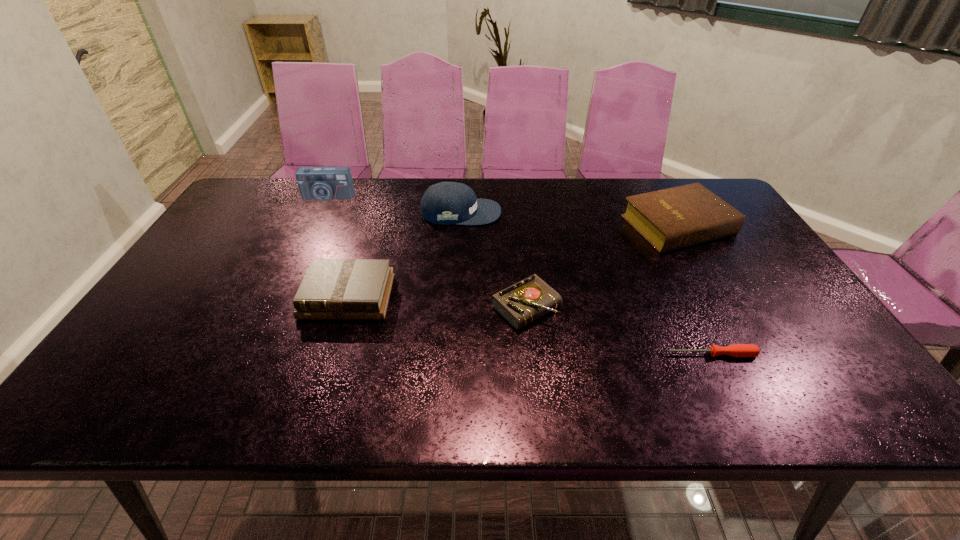
I want to click on free space located 0.210m on the spine side of the nearer Bible, so click(x=316, y=397).

Where is `blank space located 0.280m on the right of the diary`? blank space located 0.280m on the right of the diary is located at coordinates (673, 307).

Locate an element on the screen. This screenshot has height=540, width=960. free space located at the tip of the screwdriver is located at coordinates (547, 354).

You are a GUI agent. You are given a task and a screenshot of the screen. Output one action in this format:
    pyautogui.click(x=<x>, y=<y>)
    Task: Click on the free location located at the tip of the screwdriver
    The height and width of the screenshot is (540, 960).
    Given the screenshot: What is the action you would take?
    pyautogui.click(x=494, y=354)

Where is `vacant region located at the tip of the screwdriver`? Image resolution: width=960 pixels, height=540 pixels. vacant region located at the tip of the screwdriver is located at coordinates [x=636, y=354].

I want to click on camera located at the far edge, so click(x=315, y=183).

Locate an element on the screen. Image resolution: width=960 pixels, height=540 pixels. baseball cap present at the far edge is located at coordinates (445, 203).

Find the location of a particular element. Image resolution: width=960 pixels, height=540 pixels. Bible that is at the far edge is located at coordinates [673, 218].

Identify the location of object present at the right edge. (673, 218).

Where is `object that is positioned at the far right corner`? This screenshot has height=540, width=960. object that is positioned at the far right corner is located at coordinates (673, 218).